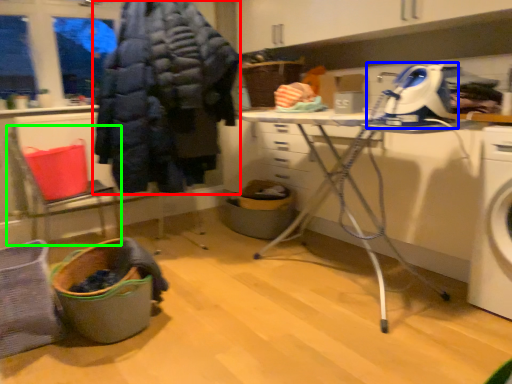
Question: Estimate the real-world distances between objects in this image. Which object is closer to clothing (highlighted by a red box), sewing machine (highlighted by a blue box) or chair (highlighted by a green box)?

Choices:
 (A) sewing machine
 (B) chair

Answer: (B)